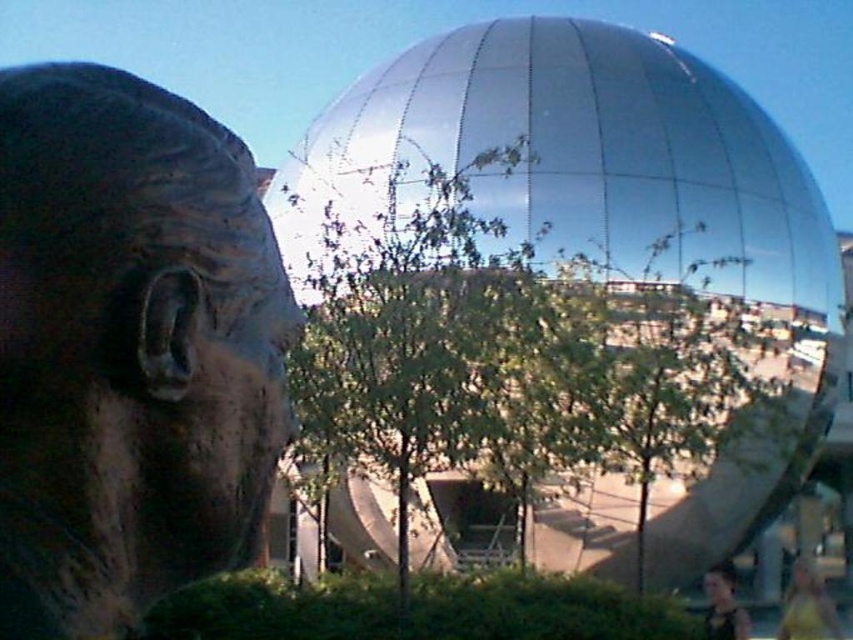
Question: Is green leafy tree at center below yellow fabric shirt at lower right?

Choices:
 (A) no
 (B) yes

Answer: (A)

Question: Which object is closer to the camera taking this photo?

Choices:
 (A) green leafy tree at center
 (B) brown stone statue at left
 (C) dark brown hair at lower right
 (D) yellow fabric shirt at lower right

Answer: (B)

Question: Which point appears closest to the camera in this image?

Choices:
 (A) (15, 291)
 (B) (809, 611)
 (C) (335, 330)
 (D) (732, 625)

Answer: (A)

Question: Does green leafy tree at center have a greater width compared to yellow fabric shirt at lower right?

Choices:
 (A) no
 (B) yes

Answer: (B)

Question: Which object appears closest to the camera in this image?

Choices:
 (A) brown stone statue at left
 (B) green leafy tree at center
 (C) yellow fabric shirt at lower right

Answer: (A)

Question: From the image, what is the correct spatial relationship of brown stone statue at left in relation to yellow fabric shirt at lower right?

Choices:
 (A) below
 (B) above

Answer: (B)